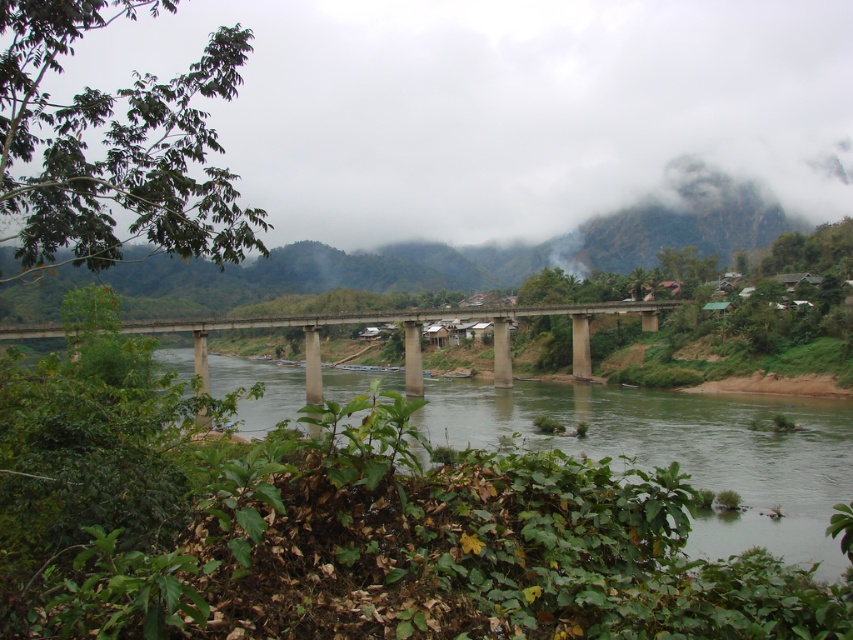
You are standing on the left side of the concrete bridge at center. You want to cross to the right side. Which direction should you face to see the green grassy river at center?

You should face to the left because the green grassy river at center is located to the left of the concrete bridge at center.

You are standing on the bridge looking at the white fluffy cloud at upper center and the green grassy river at center. Which object is closer to you?

The white fluffy cloud at upper center is closer to you because it is further to the viewer than the green grassy river at center.

You are an airplane pilot flying over the landscape. You see the white fluffy cloud at upper center and the concrete bridge at center. Which object is positioned to the right side from your perspective?

The white fluffy cloud at upper center is positioned to the right of the concrete bridge at center, so the white fluffy cloud at upper center is on the right side.